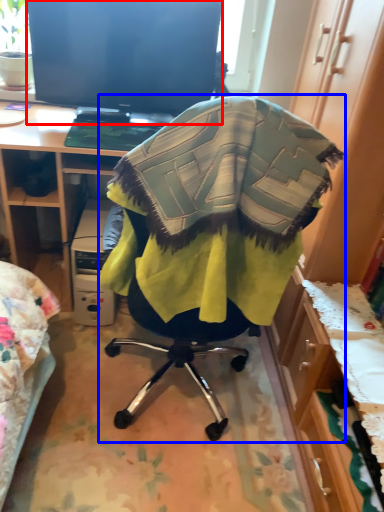
Question: Which point is further to the camera, television (highlighted by a red box) or chair (highlighted by a blue box)?

Choices:
 (A) television
 (B) chair

Answer: (A)